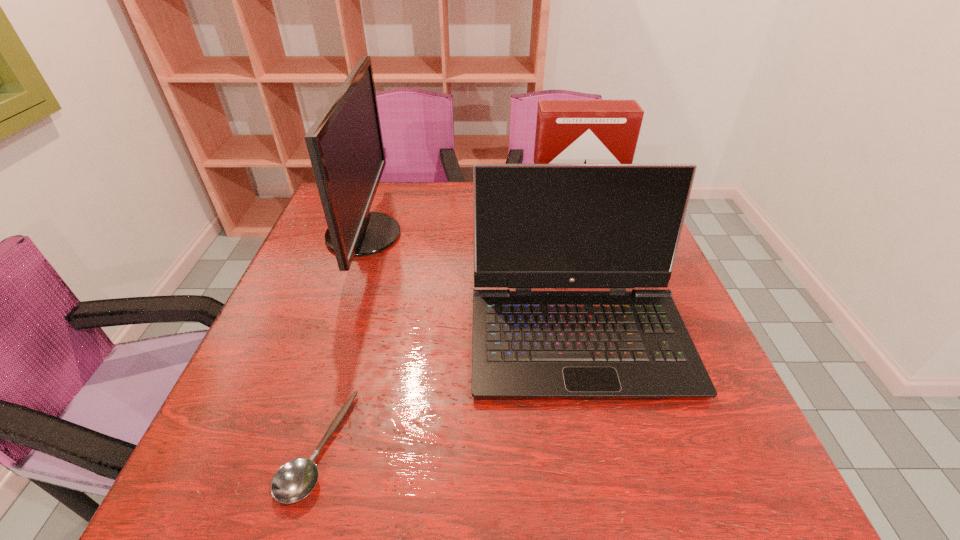
Identify the location of vacant space that satisfies the following two spatial constraints: 1. on the screen side of the monitor; 2. on the back side of the ladle. The width and height of the screenshot is (960, 540). (292, 446).

Locate an element on the screen. This screenshot has height=540, width=960. vacant space that satisfies the following two spatial constraints: 1. on the front-facing side of the cigarette_case; 2. on the screen side of the monitor is located at coordinates (571, 235).

Image resolution: width=960 pixels, height=540 pixels. In order to click on free space that satisfies the following two spatial constraints: 1. on the screen side of the shortest object; 2. on the right side of the monitor in this screenshot , I will do `click(292, 446)`.